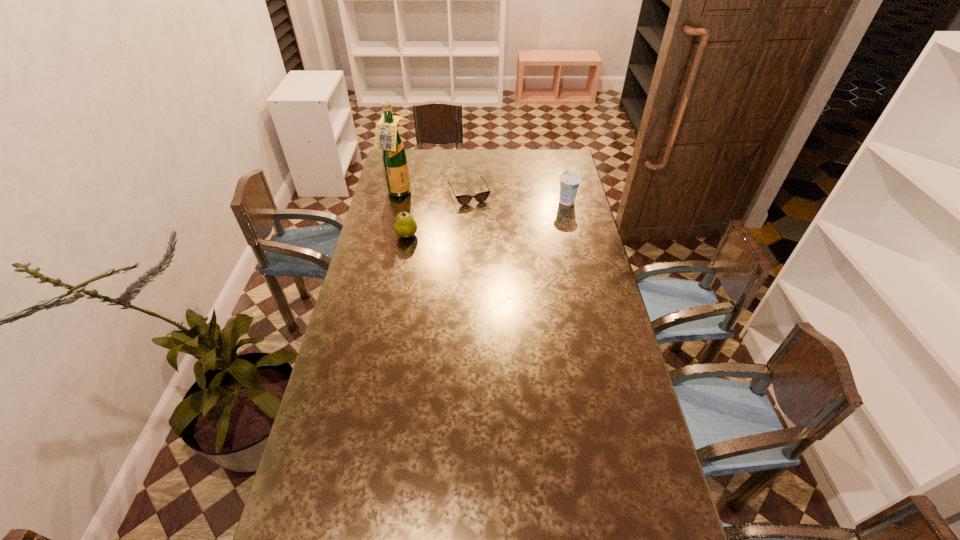
The image size is (960, 540). What are the coordinates of `vacant area between the nearest object and the second object from right to left` in the screenshot? It's located at (438, 214).

Where is `blank region between the tallest object and the shortest object`? The width and height of the screenshot is (960, 540). blank region between the tallest object and the shortest object is located at coordinates (434, 193).

Locate an element on the screen. The height and width of the screenshot is (540, 960). vacant space in between the yogurt and the nearest object is located at coordinates (487, 218).

The height and width of the screenshot is (540, 960). What are the coordinates of `vacant area between the yogurt and the sunglasses` in the screenshot? It's located at (517, 197).

Where is `empty location between the sunglasses and the liquor`? empty location between the sunglasses and the liquor is located at coordinates (434, 193).

I want to click on unoccupied position between the pear and the rightmost object, so click(487, 218).

What are the coordinates of `the closest object to the shortest object` in the screenshot? It's located at (394, 157).

Locate an element on the screen. the third closest object to the rightmost object is located at coordinates (394, 157).

This screenshot has width=960, height=540. I want to click on vacant point that satisfies the following two spatial constraints: 1. on the front side of the tallest object; 2. on the left side of the rightmost object, so click(x=396, y=200).